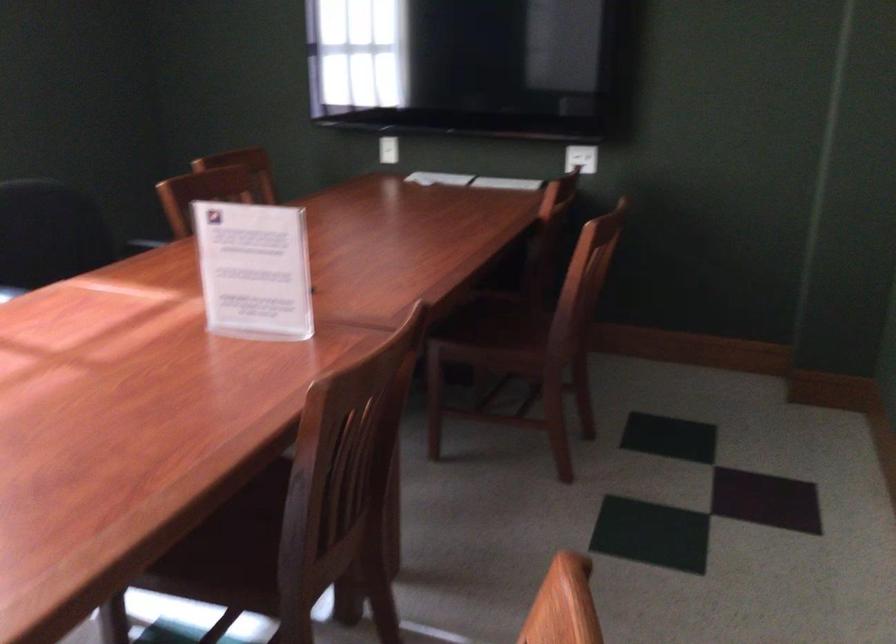
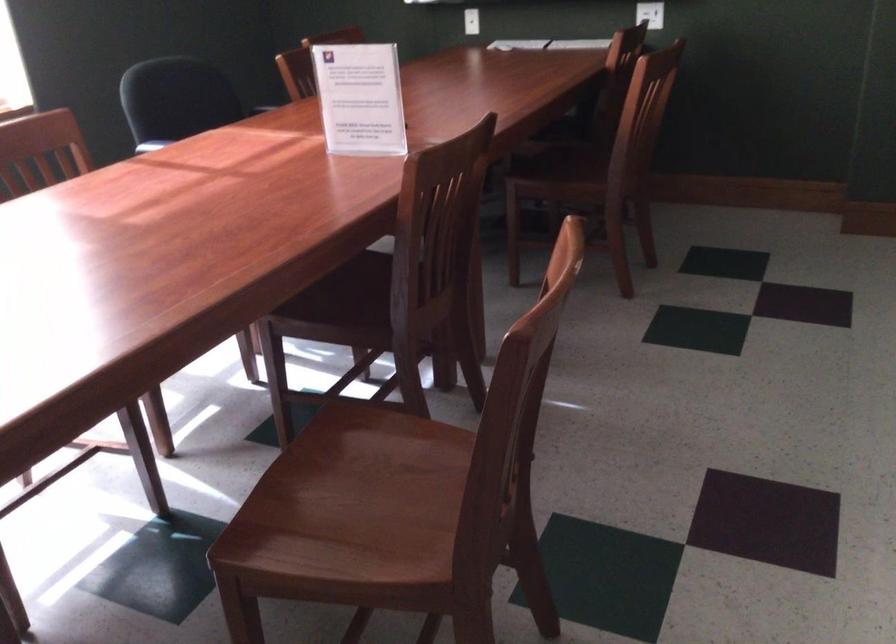
Locate, in the second image, the point that corresponds to (256,269) in the first image.

(359, 98)